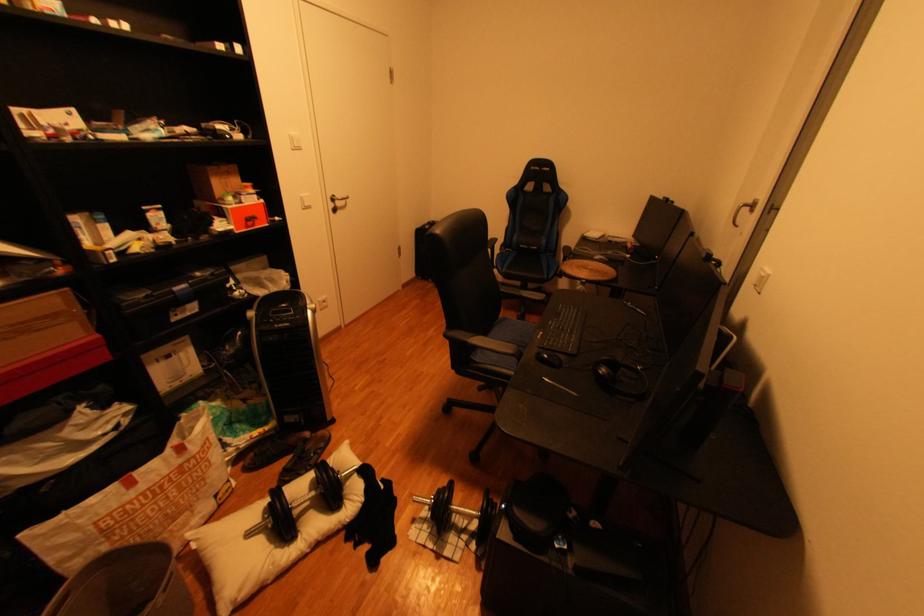
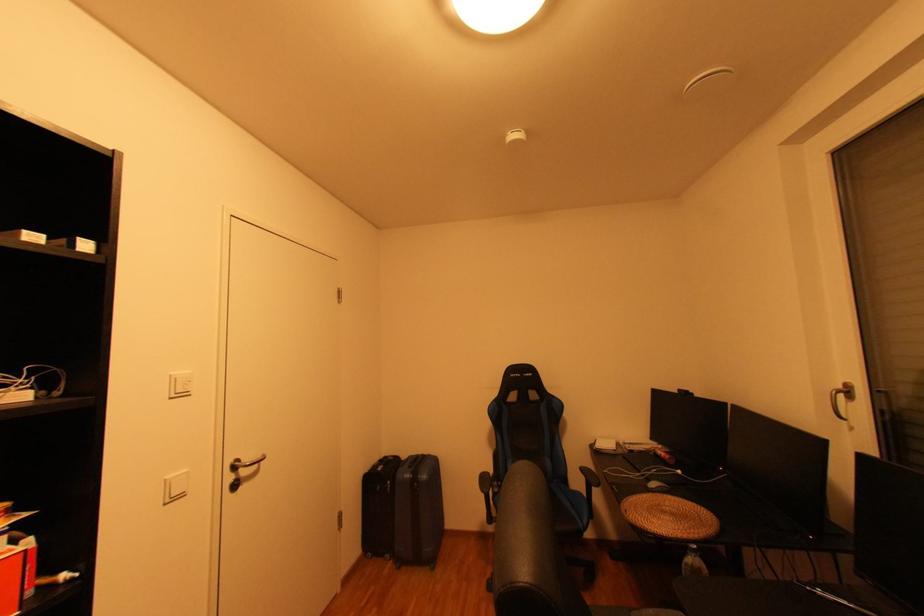
Where in the second image is the point corresponding to (x=345, y=197) from the first image?

(247, 461)